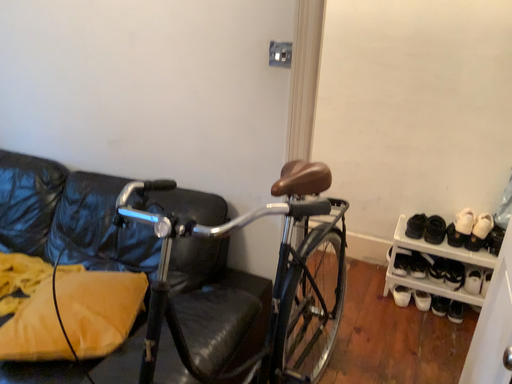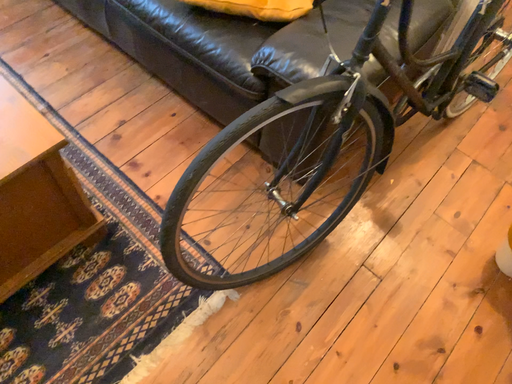
Question: Which way did the camera rotate in the video?

Choices:
 (A) rotated downward
 (B) rotated upward

Answer: (A)